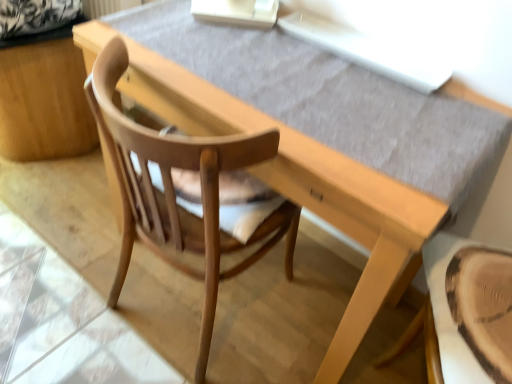
The width and height of the screenshot is (512, 384). What do you see at coordinates (183, 198) in the screenshot?
I see `light brown wood chair at center` at bounding box center [183, 198].

Locate an element on the screen. Image resolution: width=512 pixels, height=384 pixels. light brown wood chair at center is located at coordinates (183, 198).

This screenshot has height=384, width=512. I want to click on light brown wood chair at center, so click(183, 198).